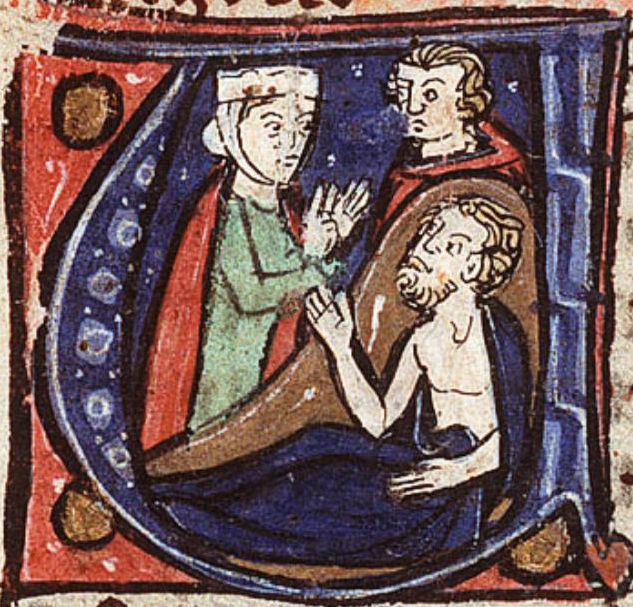
Locate an element on the screen. chest is located at coordinates (453, 348).